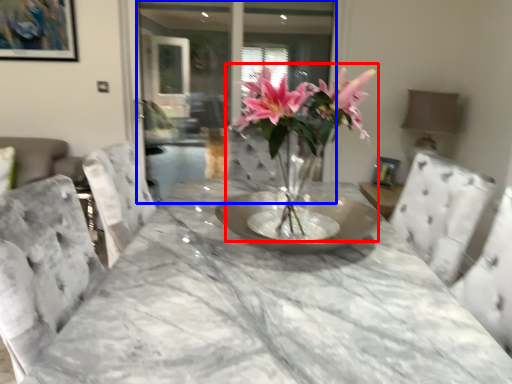
Question: Among these objects, which one is nearest to the camera, houseplant (highlighted by a red box) or glass door (highlighted by a blue box)?

Choices:
 (A) houseplant
 (B) glass door

Answer: (A)